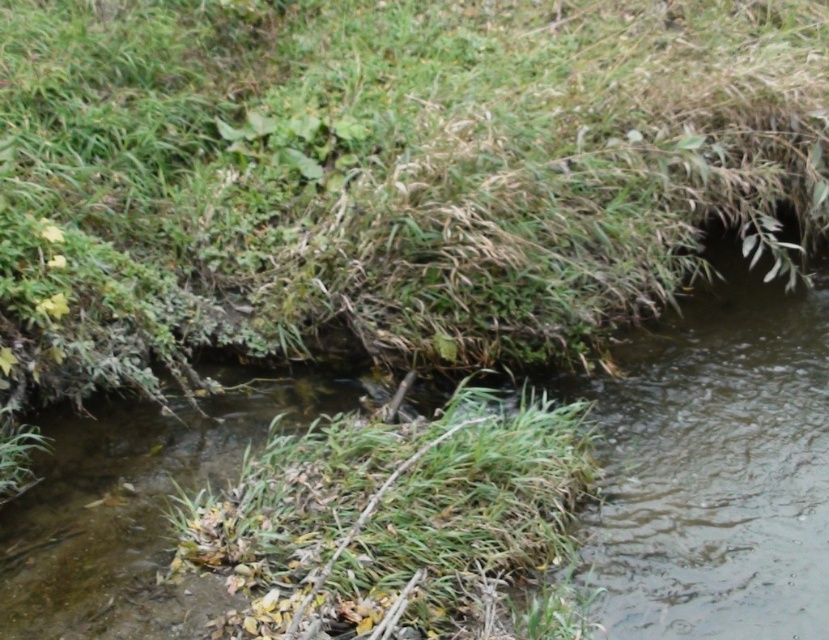
Question: Does clear water at center appear on the left side of green grass at center?

Choices:
 (A) no
 (B) yes

Answer: (A)

Question: Which point appears farthest from the camera in this image?

Choices:
 (A) (779, 378)
 (B) (277, 552)

Answer: (A)

Question: Is clear water at center bigger than green grass at center?

Choices:
 (A) yes
 (B) no

Answer: (A)

Question: Among these objects, which one is nearest to the camera?

Choices:
 (A) clear water at center
 (B) green grass at center

Answer: (B)

Question: Is clear water at center wider than green grass at center?

Choices:
 (A) yes
 (B) no

Answer: (A)